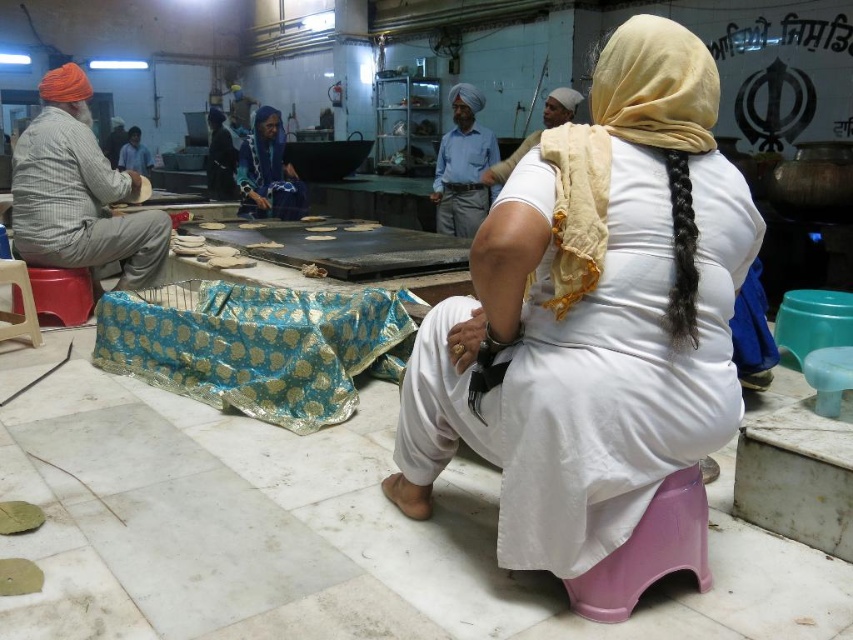
Question: Among these objects, which one is farthest from the camera?

Choices:
 (A) blue fabric at upper left
 (B) white cotton turban at upper center

Answer: (A)

Question: Does white cloth at center lie behind blue fabric at upper left?

Choices:
 (A) no
 (B) yes

Answer: (A)

Question: Estimate the real-world distances between objects in this image. Which object is closer to the matte plastic stool at lower center?

Choices:
 (A) white cotton turban at upper center
 (B) blue brocade cloth at center
 (C) blue fabric at upper left

Answer: (B)

Question: Does white cloth at center appear on the left side of blue fabric at upper left?

Choices:
 (A) no
 (B) yes

Answer: (A)

Question: Is matte plastic stool at lower center below dark blue fabric at center?

Choices:
 (A) yes
 (B) no

Answer: (A)

Question: Among these points, which one is farthest from the camera?

Choices:
 (A) (143, 163)
 (B) (212, 166)
 (C) (619, 83)
 (D) (219, 317)

Answer: (A)